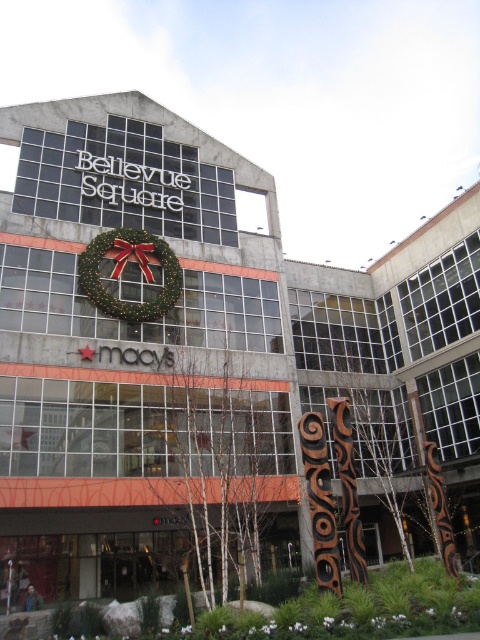
Question: Is brown carved wood totem pole at center closer to camera compared to green matte wreath at center?

Choices:
 (A) no
 (B) yes

Answer: (B)

Question: Which object appears closest to the camera in this image?

Choices:
 (A) brown carved wood totem pole at center
 (B) green matte wreath at center

Answer: (A)

Question: Which of the following is the closest to the observer?

Choices:
 (A) (144, 310)
 (B) (347, 424)

Answer: (B)

Question: Does brown carved wood totem pole at center appear over green matte wreath at center?

Choices:
 (A) no
 (B) yes

Answer: (A)

Question: Can you confirm if brown carved wood totem pole at center is bigger than green matte wreath at center?

Choices:
 (A) yes
 (B) no

Answer: (A)